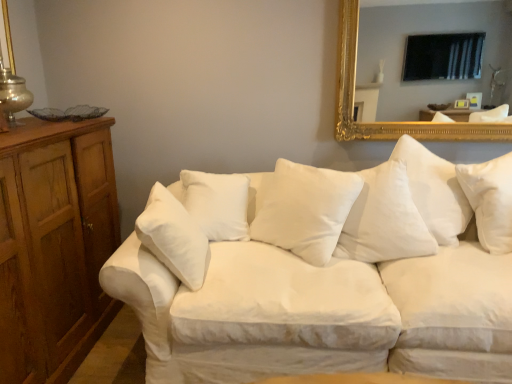
Question: Is gold-framed mirror at upper right surrounding white cotton couch at center?

Choices:
 (A) yes
 (B) no

Answer: (B)

Question: From the image's perspective, is gold-framed mirror at upper right over white cotton couch at center?

Choices:
 (A) no
 (B) yes

Answer: (B)

Question: Is gold-framed mirror at upper right directly adjacent to white cotton couch at center?

Choices:
 (A) no
 (B) yes

Answer: (A)

Question: Does gold-framed mirror at upper right come in front of white cotton couch at center?

Choices:
 (A) no
 (B) yes

Answer: (A)

Question: Is gold-framed mirror at upper right oriented towards white cotton couch at center?

Choices:
 (A) yes
 (B) no

Answer: (B)

Question: Is white cotton couch at center spatially inside gold-framed mirror at upper right, or outside of it?

Choices:
 (A) inside
 (B) outside

Answer: (B)

Question: Does point (179, 218) appear closer or farther from the camera than point (358, 135)?

Choices:
 (A) closer
 (B) farther

Answer: (A)

Question: Considering the relative positions of white cotton couch at center and gold-framed mirror at upper right in the image provided, is white cotton couch at center to the left or to the right of gold-framed mirror at upper right?

Choices:
 (A) right
 (B) left

Answer: (B)

Question: In the image, is white cotton couch at center positioned in front of or behind gold-framed mirror at upper right?

Choices:
 (A) behind
 (B) front

Answer: (B)

Question: From the image's perspective, relative to gold-framed mirror at upper right, is white soft cushion at center above or below?

Choices:
 (A) below
 (B) above

Answer: (A)

Question: Based on their sizes in the image, would you say white soft cushion at center is bigger or smaller than gold-framed mirror at upper right?

Choices:
 (A) big
 (B) small

Answer: (A)

Question: Is point (304, 206) closer or farther from the camera than point (406, 125)?

Choices:
 (A) closer
 (B) farther

Answer: (A)

Question: From a real-world perspective, is white soft cushion at center positioned above or below gold-framed mirror at upper right?

Choices:
 (A) above
 (B) below

Answer: (B)

Question: Is point (349, 104) closer or farther from the camera than point (331, 203)?

Choices:
 (A) closer
 (B) farther

Answer: (B)

Question: Considering the positions of gold-framed mirror at upper right and white cotton couch at center in the image, is gold-framed mirror at upper right wider or thinner than white cotton couch at center?

Choices:
 (A) wide
 (B) thin

Answer: (B)